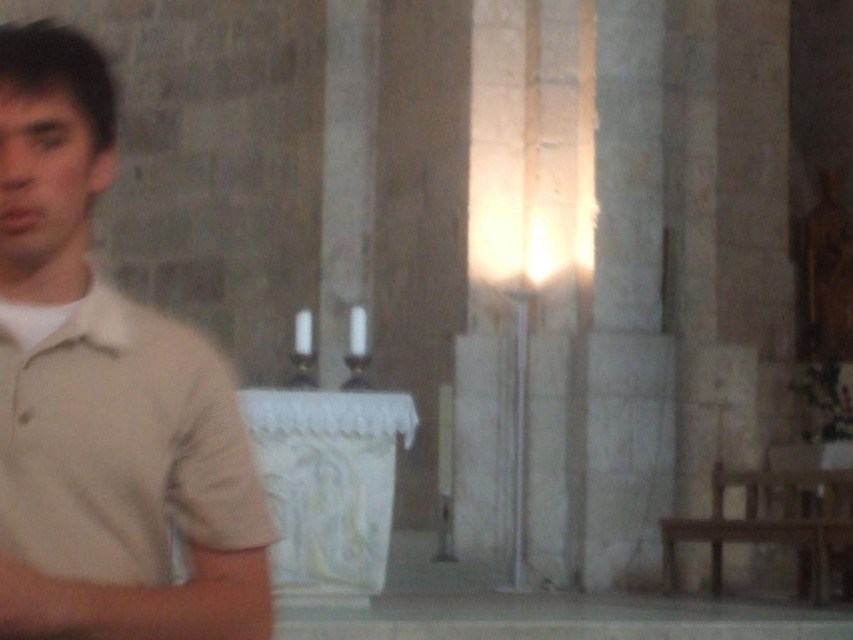
Looking at this image, you are standing at the entrance of the cathedral and want to sit down. You see the beige cotton shirt at left and the wooden bench at lower right. Which object is wider?

The beige cotton shirt at left might be wider than wooden bench at lower right.

You are standing in the cathedral and want to sit down. There is a beige cotton shirt at left and a wooden bench at lower right. Which object is closer to your current position if you are facing the altar?

The beige cotton shirt at left is closer to your current position because it is positioned on the left side of the wooden bench at lower right, meaning it is nearer to the entrance area where you are standing.

You are standing in the historic stone building and want to determine the relative positions of two points marked in the scene. Which point is nearer to you, point (25,461) or point (846,477)?

Point (25,461) is closer to the viewer than point (846,477) according to the spatial description provided.